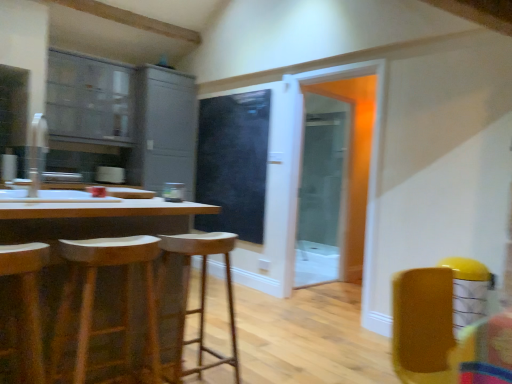
Question: Which direction should I rotate to look at wooden stool at center, arranged as the 1th stool when viewed from the back, — up or down?

Choices:
 (A) down
 (B) up

Answer: (A)

Question: Is wooden bar stool at left, arranged as the 3th stool when viewed from the back, looking in the opposite direction of matte gray cabinets at upper left, which is the 2th cabinetry in right-to-left order?

Choices:
 (A) no
 (B) yes

Answer: (A)

Question: From the image's perspective, is wooden bar stool at left, arranged as the 3th stool when viewed from the back, below matte gray cabinets at upper left, which is the 2th cabinetry in right-to-left order?

Choices:
 (A) no
 (B) yes

Answer: (B)

Question: Is wooden bar stool at left, positioned as the 1th stool in front-to-back order, not within matte gray cabinets at upper left, which is the 2th cabinetry in right-to-left order?

Choices:
 (A) yes
 (B) no

Answer: (A)

Question: Is wooden bar stool at left, arranged as the 3th stool when viewed from the back, taller than matte gray cabinets at upper left, which appears as the 1th cabinetry when viewed from the left?

Choices:
 (A) yes
 (B) no

Answer: (B)

Question: Does wooden bar stool at left, arranged as the 3th stool when viewed from the back, have a greater width compared to matte gray cabinets at upper left, which is the 2th cabinetry in right-to-left order?

Choices:
 (A) no
 (B) yes

Answer: (A)

Question: Is wooden bar stool at left, positioned as the 1th stool in front-to-back order, touching matte gray cabinets at upper left, which is the 2th cabinetry in right-to-left order?

Choices:
 (A) no
 (B) yes

Answer: (A)

Question: Is wooden stool at left, the 2th stool when ordered from front to back, outside of wooden bar stool at left, arranged as the 3th stool when viewed from the back?

Choices:
 (A) yes
 (B) no

Answer: (A)

Question: Is wooden stool at left, arranged as the second stool when viewed from the back, oriented towards wooden bar stool at left, arranged as the 3th stool when viewed from the back?

Choices:
 (A) yes
 (B) no

Answer: (B)

Question: From a real-world perspective, does wooden stool at left, arranged as the second stool when viewed from the back, stand above wooden bar stool at left, positioned as the 1th stool in front-to-back order?

Choices:
 (A) yes
 (B) no

Answer: (B)

Question: Considering the relative positions of wooden stool at left, the 2th stool when ordered from front to back, and wooden bar stool at left, positioned as the 1th stool in front-to-back order, in the image provided, is wooden stool at left, the 2th stool when ordered from front to back, in front of wooden bar stool at left, positioned as the 1th stool in front-to-back order,?

Choices:
 (A) yes
 (B) no

Answer: (B)

Question: Does wooden stool at left, arranged as the second stool when viewed from the back, have a lesser width compared to wooden bar stool at left, positioned as the 1th stool in front-to-back order?

Choices:
 (A) yes
 (B) no

Answer: (A)

Question: Is wooden stool at left, the 2th stool when ordered from front to back, next to wooden bar stool at left, arranged as the 3th stool when viewed from the back, and touching it?

Choices:
 (A) yes
 (B) no

Answer: (B)

Question: Is wooden table at left surrounding black matte screen door at center, marked as the 1th screen door in a left-to-right arrangement?

Choices:
 (A) no
 (B) yes

Answer: (A)